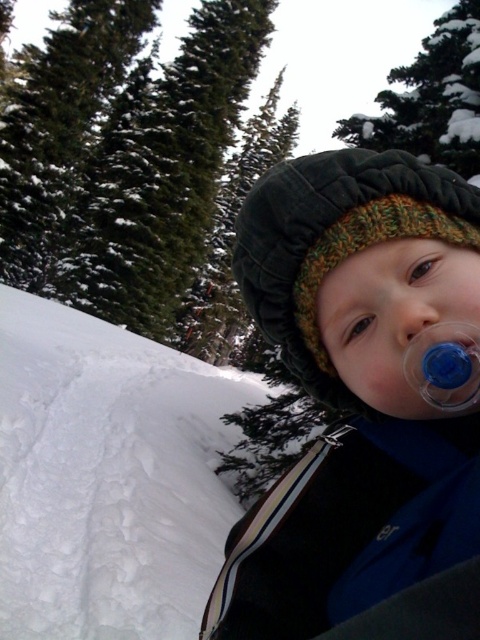
Measure the distance between white fluffy snow at lower left and camera.

white fluffy snow at lower left and camera are 2.72 meters apart from each other.

Can you confirm if white fluffy snow at lower left is positioned to the right of matte plastic nose at center?

Incorrect, white fluffy snow at lower left is not on the right side of matte plastic nose at center.

Is point (60, 547) positioned before point (420, 317)?

No.

This screenshot has width=480, height=640. What are the coordinates of `white fluffy snow at lower left` in the screenshot? It's located at (107, 477).

The image size is (480, 640). Describe the element at coordinates (107, 477) in the screenshot. I see `white fluffy snow at lower left` at that location.

Does white fluffy snow at lower left have a greater height compared to knitted woolen hat at center?

Indeed, white fluffy snow at lower left has a greater height compared to knitted woolen hat at center.

Identify the location of white fluffy snow at lower left. (107, 477).

The height and width of the screenshot is (640, 480). I want to click on blue rubber pacifier at center, so click(x=356, y=392).

Can you confirm if blue rubber pacifier at center is wider than knitted woolen hat at center?

In fact, blue rubber pacifier at center might be narrower than knitted woolen hat at center.

Where is `blue rubber pacifier at center`? blue rubber pacifier at center is located at coordinates (356, 392).